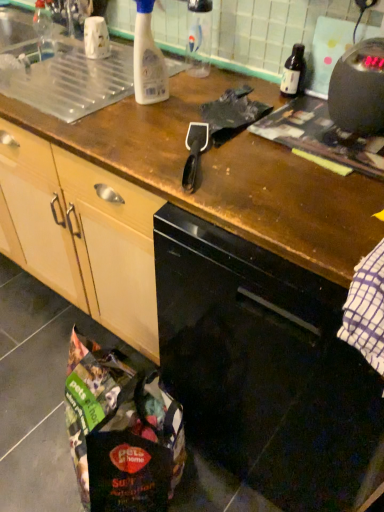
Where is `vacant space in front of black plastic spatula at center`? The height and width of the screenshot is (512, 384). vacant space in front of black plastic spatula at center is located at coordinates (220, 199).